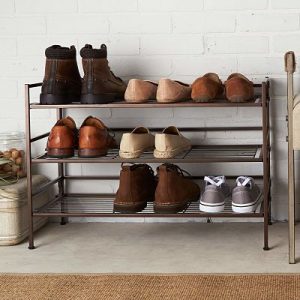
You are a GUI agent. You are given a task and a screenshot of the screen. Output one action in this format:
    pyautogui.click(x=<x>, y=<y>)
    Task: Click on the shoes rack legs
    
    Given the screenshot: What is the action you would take?
    pyautogui.click(x=33, y=244), pyautogui.click(x=63, y=219), pyautogui.click(x=270, y=220), pyautogui.click(x=268, y=246)